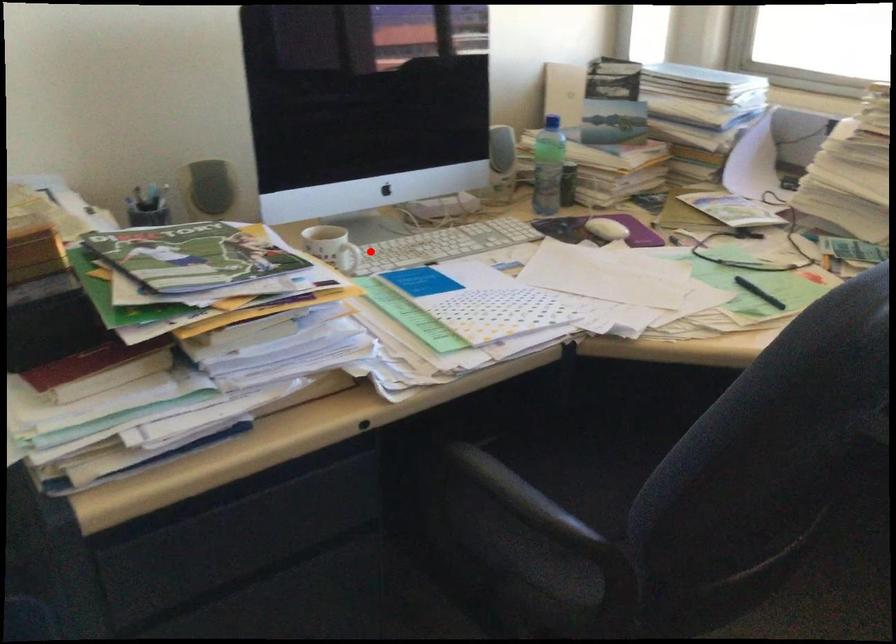
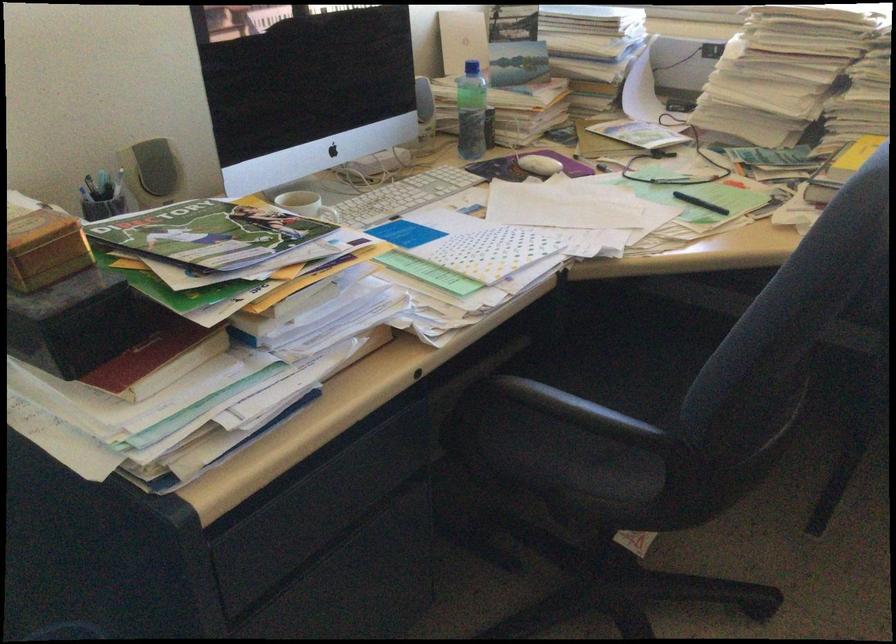
Where in the second image is the point corresponding to the highlighted location from the first image?

(334, 216)